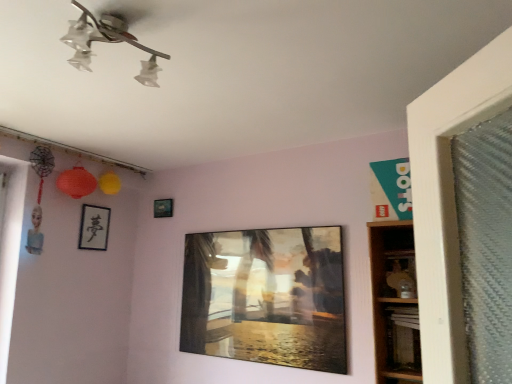
Question: Is metallic glass painting at center, the 3th picture frame in the left-to-right sequence, not inside black matte picture frame at upper left, which is counted as the first picture frame, starting from the left?

Choices:
 (A) no
 (B) yes

Answer: (B)

Question: Is metallic glass painting at center, arranged as the 1th picture frame when viewed from the front, oriented away from black matte picture frame at upper left, marked as the second picture frame in a front-to-back arrangement?

Choices:
 (A) yes
 (B) no

Answer: (B)

Question: Is metallic glass painting at center, the 3th picture frame in the left-to-right sequence, beside black matte picture frame at upper left, the 3th picture frame when ordered from right to left?

Choices:
 (A) yes
 (B) no

Answer: (B)

Question: Is black matte picture frame at upper left, marked as the second picture frame in a front-to-back arrangement, located within metallic glass painting at center, acting as the 3th picture frame starting from the back?

Choices:
 (A) no
 (B) yes

Answer: (A)

Question: From the image's perspective, would you say metallic glass painting at center, acting as the 3th picture frame starting from the back, is positioned over black matte picture frame at upper left, the 2th picture frame viewed from the back?

Choices:
 (A) yes
 (B) no

Answer: (B)

Question: Considering the relative positions of metallic glass painting at center, the 3th picture frame in the left-to-right sequence, and metallic silver picture frame at upper center, placed as the second picture frame when sorted from right to left, in the image provided, is metallic glass painting at center, the 3th picture frame in the left-to-right sequence, to the left or to the right of metallic silver picture frame at upper center, placed as the second picture frame when sorted from right to left,?

Choices:
 (A) left
 (B) right

Answer: (B)

Question: From a real-world perspective, relative to metallic silver picture frame at upper center, placed as the 1th picture frame when sorted from back to front, is metallic glass painting at center, the 1th picture frame viewed from the right, vertically above or below?

Choices:
 (A) below
 (B) above

Answer: (A)

Question: Do you think metallic glass painting at center, acting as the 3th picture frame starting from the back, is within metallic silver picture frame at upper center, which ranks as the third picture frame in front-to-back order, or outside of it?

Choices:
 (A) outside
 (B) inside

Answer: (A)

Question: Is metallic glass painting at center, arranged as the 1th picture frame when viewed from the front, taller or shorter than metallic silver picture frame at upper center, the 2th picture frame positioned from the left?

Choices:
 (A) short
 (B) tall

Answer: (B)

Question: Considering the relative positions of clear glass light fixture at upper center and wooden at right, acting as the first shelf starting from the bottom, in the image provided, is clear glass light fixture at upper center to the left or to the right of wooden at right, acting as the first shelf starting from the bottom,?

Choices:
 (A) left
 (B) right

Answer: (A)

Question: Is point (148, 76) closer or farther from the camera than point (412, 248)?

Choices:
 (A) closer
 (B) farther

Answer: (A)

Question: From the image's perspective, is clear glass light fixture at upper center positioned above or below wooden at right, acting as the first shelf starting from the bottom?

Choices:
 (A) above
 (B) below

Answer: (A)

Question: Is clear glass light fixture at upper center spatially inside wooden at right, which is the second shelf from top to bottom, or outside of it?

Choices:
 (A) inside
 (B) outside

Answer: (B)

Question: Looking at their shapes, would you say wooden at right, which is the second shelf from top to bottom, is wider or thinner than black matte picture frame at upper left, the 2th picture frame viewed from the back?

Choices:
 (A) wide
 (B) thin

Answer: (A)

Question: Considering the relative positions of wooden at right, which is the second shelf from top to bottom, and black matte picture frame at upper left, marked as the second picture frame in a front-to-back arrangement, in the image provided, is wooden at right, which is the second shelf from top to bottom, to the left or to the right of black matte picture frame at upper left, marked as the second picture frame in a front-to-back arrangement,?

Choices:
 (A) right
 (B) left

Answer: (A)